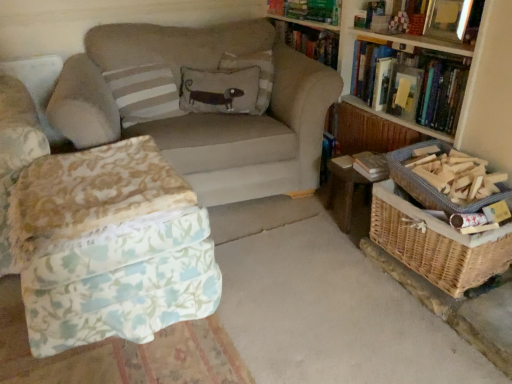
Question: Should I look upward or downward to see wooden bookcase at upper right?

Choices:
 (A) up
 (B) down

Answer: (A)

Question: Is wooden bookcase at upper right shorter than brown fabric pillow with dog design at center, the 2th pillow viewed from the right?

Choices:
 (A) no
 (B) yes

Answer: (A)

Question: Does wooden bookcase at upper right have a greater height compared to brown fabric pillow with dog design at center, acting as the second pillow starting from the left?

Choices:
 (A) no
 (B) yes

Answer: (B)

Question: Is wooden bookcase at upper right at the left side of brown fabric pillow with dog design at center, acting as the second pillow starting from the left?

Choices:
 (A) no
 (B) yes

Answer: (A)

Question: Is wooden bookcase at upper right next to brown fabric pillow with dog design at center, the 2th pillow viewed from the right?

Choices:
 (A) yes
 (B) no

Answer: (B)

Question: Is brown fabric pillow with dog design at center, acting as the second pillow starting from the left, surrounded by wooden bookcase at upper right?

Choices:
 (A) no
 (B) yes

Answer: (A)

Question: Does wooden bookcase at upper right lie behind brown fabric pillow with dog design at center, acting as the second pillow starting from the left?

Choices:
 (A) yes
 (B) no

Answer: (B)

Question: Is woven wood table at lower right aimed at white striped pillow at upper left, the third pillow from the right?

Choices:
 (A) yes
 (B) no

Answer: (B)

Question: Can you confirm if woven wood table at lower right is bigger than white striped pillow at upper left, the third pillow from the right?

Choices:
 (A) no
 (B) yes

Answer: (A)

Question: Is woven wood table at lower right beside white striped pillow at upper left, the third pillow from the right?

Choices:
 (A) yes
 (B) no

Answer: (B)

Question: From the image's perspective, would you say woven wood table at lower right is shown under white striped pillow at upper left, the third pillow from the right?

Choices:
 (A) yes
 (B) no

Answer: (A)

Question: Is woven wood table at lower right shorter than white striped pillow at upper left, the 1th pillow viewed from the left?

Choices:
 (A) no
 (B) yes

Answer: (B)

Question: Is woven wood table at lower right at the left side of white striped pillow at upper left, the third pillow from the right?

Choices:
 (A) no
 (B) yes

Answer: (A)

Question: From the image's perspective, is woven brown basket at right, the 1th basket when ordered from top to bottom, below woven wood table at lower right?

Choices:
 (A) no
 (B) yes

Answer: (A)